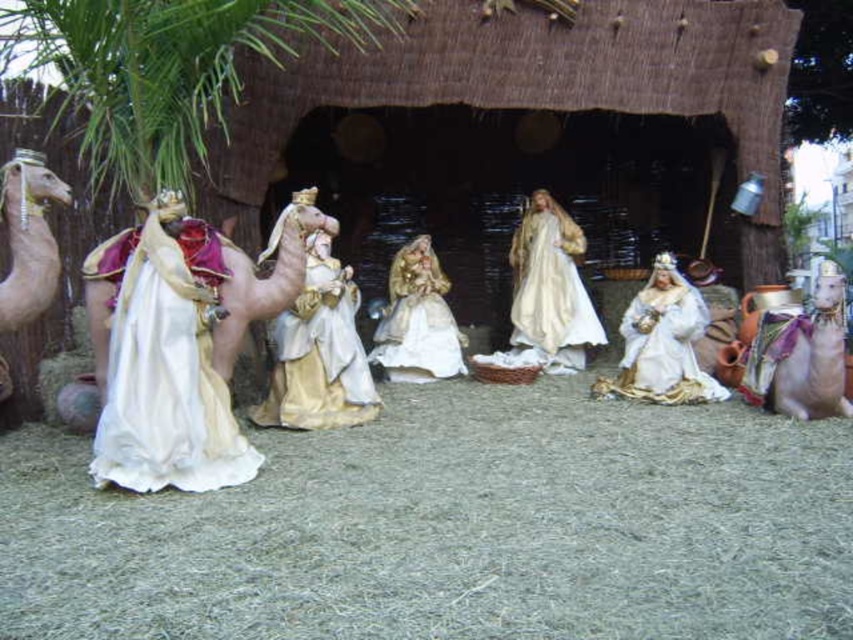
You are standing in front of the nativity scene and want to touch the smooth beige camel at lower right. Considering your height is 5 feet, can you reach the camel without any assistance?

The smooth beige camel at lower right is 10.20 feet from viewer, so since your height is 5 feet, you cannot reach the camel without assistance.

You are a toy organizer trying to arrange the gold satin dress at center and the beige fabric camel at left on a shelf. The shelf has a width of 2 meters. Can both items be placed side by side without overlapping?

The gold satin dress at center and beige fabric camel at left are 2.02 meters apart from each other. Since the shelf is only 2 meters wide, placing them side by side would require 2.02 meters of space, which exceeds the shelf width. Therefore, they cannot be placed without overlapping.